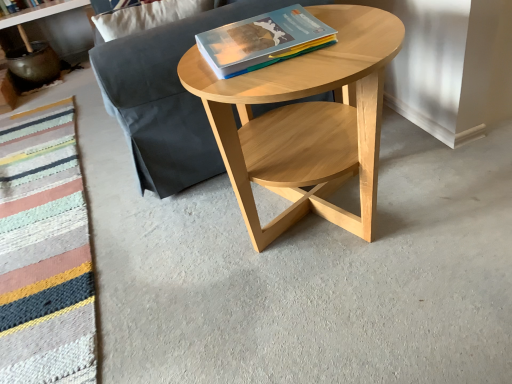
Question: Is dark gray fabric couch at center bigger or smaller than natural wood coffee table at center?

Choices:
 (A) small
 (B) big

Answer: (B)

Question: Relative to natural wood coffee table at center, is dark gray fabric couch at center in front or behind?

Choices:
 (A) front
 (B) behind

Answer: (B)

Question: Considering the real-world distances, which object is farthest from the dark gray fabric couch at center?

Choices:
 (A) matte paper book at center
 (B) natural wood coffee table at center
 (C) knitted wool blanket at lower left
 (D) matte white shelf at upper left

Answer: (D)

Question: Which of these objects is positioned closest to the dark gray fabric couch at center?

Choices:
 (A) natural wood coffee table at center
 (B) matte white shelf at upper left
 (C) knitted wool blanket at lower left
 (D) matte paper book at center

Answer: (A)